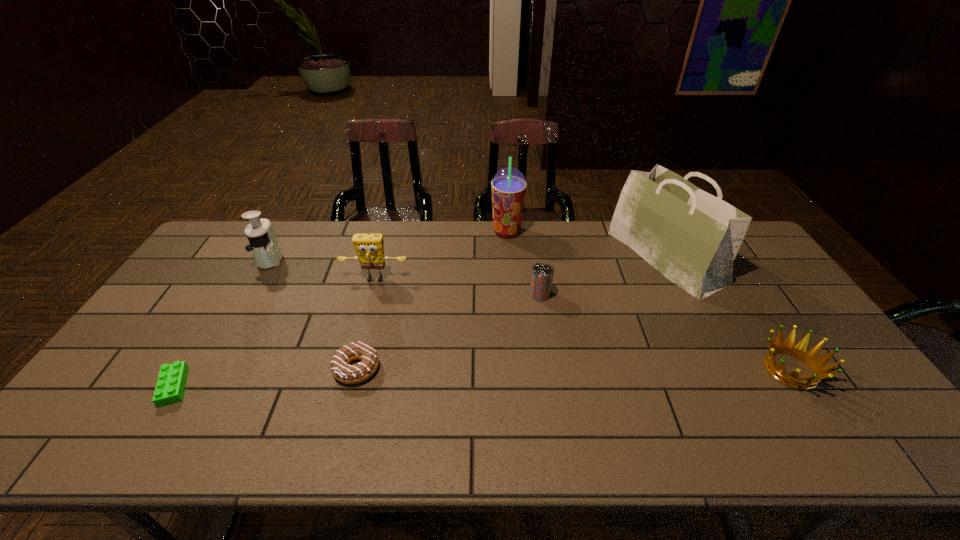
You are a GUI agent. You are given a task and a screenshot of the screen. Output one action in this format:
    pyautogui.click(x=<x>, y=<y>)
    Task: Click on the free space located 0.150m on the front of the juicer
    The height and width of the screenshot is (540, 960).
    Given the screenshot: What is the action you would take?
    pyautogui.click(x=246, y=304)

The height and width of the screenshot is (540, 960). I want to click on free spot located 0.090m on the face of the sponge, so click(368, 307).

Locate an element on the screen. This screenshot has width=960, height=540. vacant region located on the front of the beer can is located at coordinates (544, 323).

Where is `free space located 0.050m on the right of the crown`? Image resolution: width=960 pixels, height=540 pixels. free space located 0.050m on the right of the crown is located at coordinates (843, 370).

Identify the location of vacant position located on the back of the doughnut. [x=377, y=290].

At what (x,y) coordinates should I click in order to perform the action: click on free space located on the front of the Lego. Please return your answer as a coordinate pair (x, y). This screenshot has height=540, width=960. Looking at the image, I should click on (144, 435).

Locate an element on the screen. The height and width of the screenshot is (540, 960). grocery bag that is positioned at the far edge is located at coordinates (691, 237).

This screenshot has width=960, height=540. I want to click on smoothie at the far edge, so click(508, 186).

The image size is (960, 540). Identify the location of juicer at the far edge. (264, 245).

This screenshot has height=540, width=960. Find the location of `object present at the left edge`. object present at the left edge is located at coordinates (170, 386).